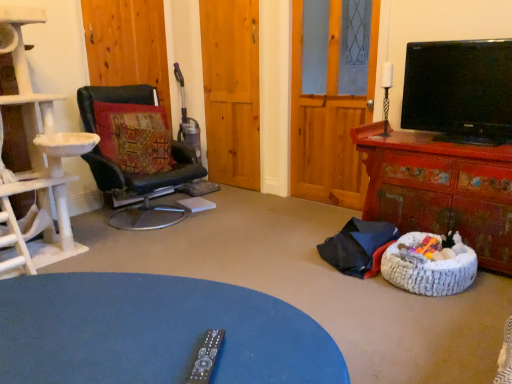
What are the coordinates of `vacant region to the left of white woven dog bed at lower right` in the screenshot? It's located at (358, 291).